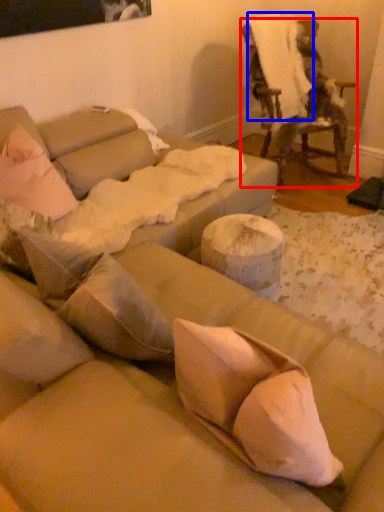
Question: Which point is further to the camera, chair (highlighted by a red box) or linen (highlighted by a blue box)?

Choices:
 (A) chair
 (B) linen

Answer: (B)